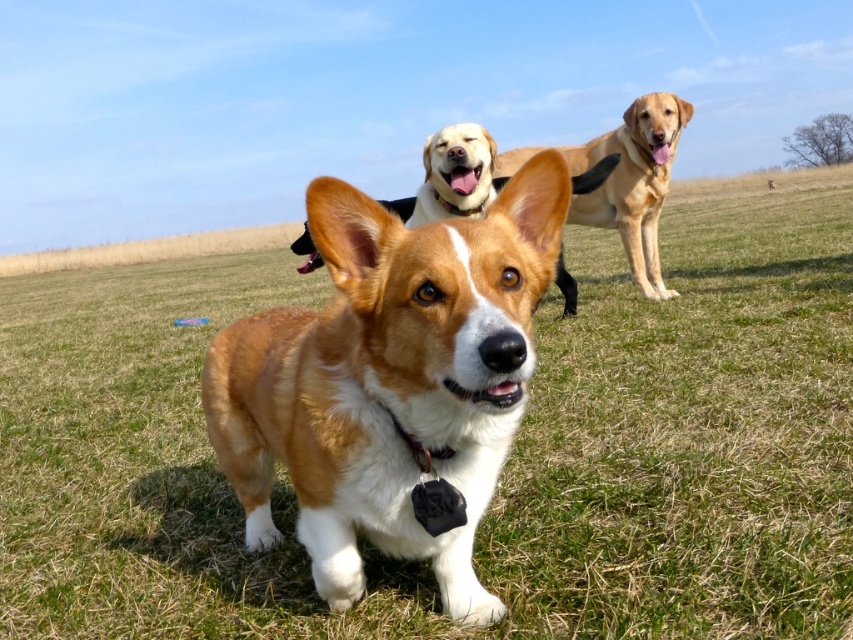
Who is shorter, brown and white fur at center or golden fur dog at center?

brown and white fur at center

Is brown and white fur at center behind golden fur dog at center?

No, it is in front of golden fur dog at center.

Is point (204, 380) behind point (659, 147)?

That is False.

Identify the location of brown and white fur at center. (389, 380).

Which is above, green grass at center or golden fur dog at center?

green grass at center

Does point (195, 566) come behind point (666, 289)?

No, (195, 566) is in front of (666, 289).

Image resolution: width=853 pixels, height=640 pixels. Describe the element at coordinates (503, 467) in the screenshot. I see `green grass at center` at that location.

You are a GUI agent. You are given a task and a screenshot of the screen. Output one action in this format:
    pyautogui.click(x=<x>, y=<y>)
    Task: Click on the green grass at center
    The width and height of the screenshot is (853, 640).
    Given the screenshot: What is the action you would take?
    pyautogui.click(x=503, y=467)

This screenshot has width=853, height=640. What do you see at coordinates (503, 467) in the screenshot? I see `green grass at center` at bounding box center [503, 467].

Which is below, green grass at center or brown and white fur at center?

brown and white fur at center is below.

Which is behind, point (807, 620) or point (492, 342)?

Point (807, 620)

At what (x,y) coordinates should I click in order to perform the action: click on green grass at center. Please return your answer as a coordinate pair (x, y). Looking at the image, I should click on (503, 467).